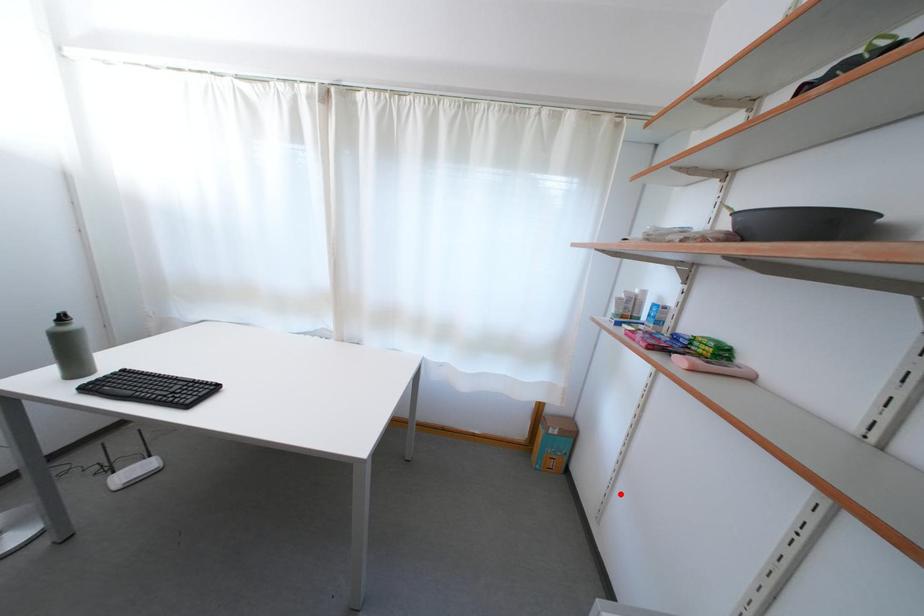
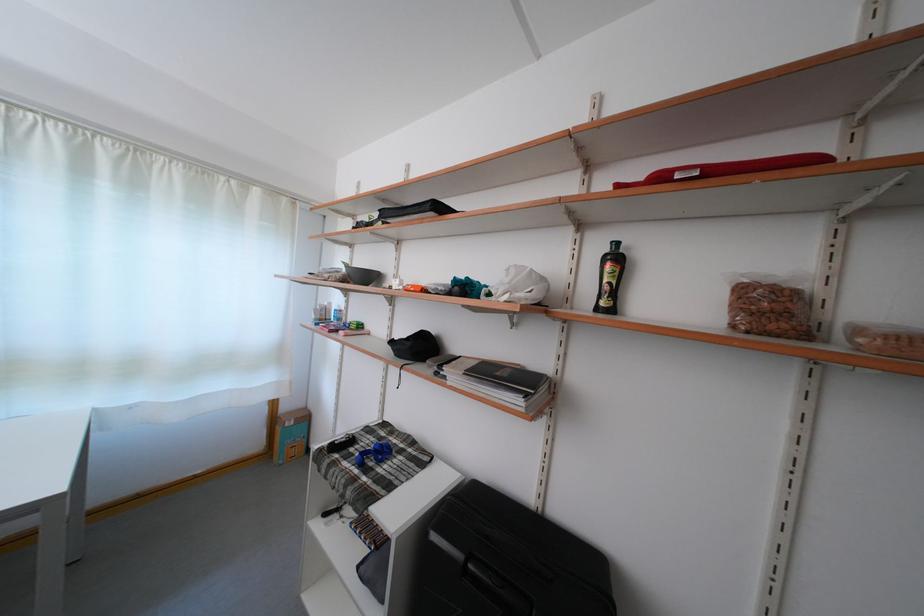
The point at the highlighted location is marked in the first image. Where is the corresponding point in the second image?

(344, 436)